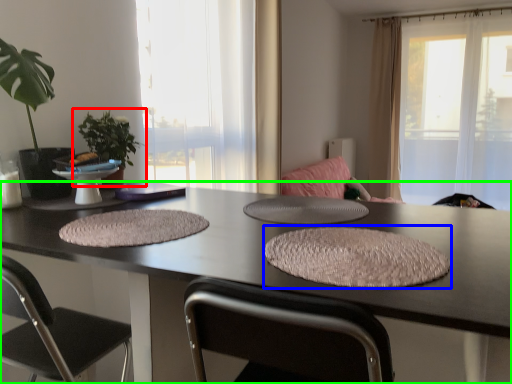
Question: Which is nearer to the houseplant (highlighted by a red box)? yoga mat (highlighted by a blue box) or table (highlighted by a green box).

Choices:
 (A) yoga mat
 (B) table

Answer: (B)